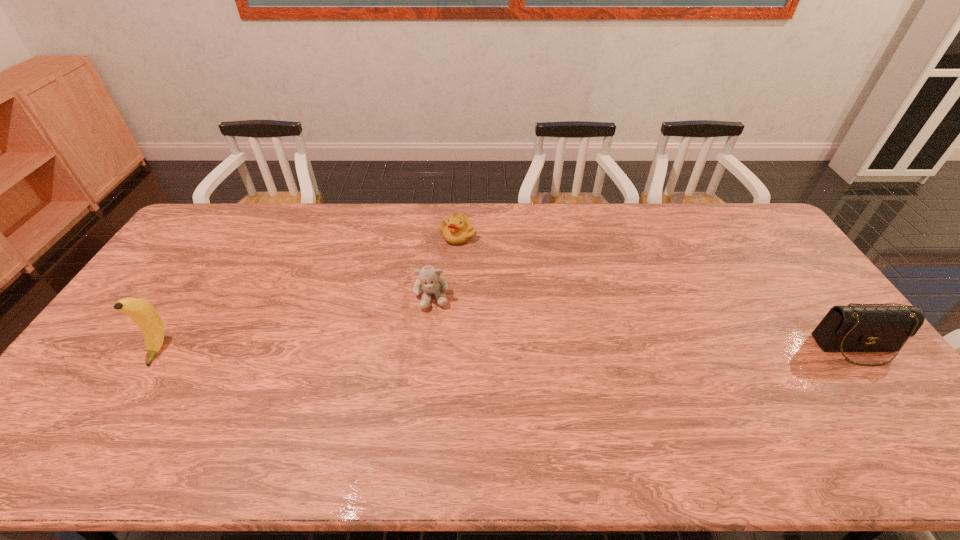
Where is `banana`? Image resolution: width=960 pixels, height=540 pixels. banana is located at coordinates (145, 316).

Locate an element on the screen. the tallest object is located at coordinates (145, 316).

This screenshot has width=960, height=540. Identify the location of clutch bag. (871, 328).

This screenshot has height=540, width=960. Identify the location of the shortest object. tap(458, 229).

Where is `duckling`? duckling is located at coordinates (458, 229).

Where is `the second farthest object`? the second farthest object is located at coordinates (429, 282).

I want to click on vacant space located 0.090m from the stem of the banana, so click(129, 396).

This screenshot has height=540, width=960. I want to click on vacant space located on the front flap of the clutch bag, so click(x=883, y=383).

Identify the location of vacant area situated 0.190m on the front-facing side of the farthest object. The height and width of the screenshot is (540, 960). click(441, 285).

What are the coordinates of `vacant region located on the front-facing side of the farthest object` in the screenshot? It's located at (438, 293).